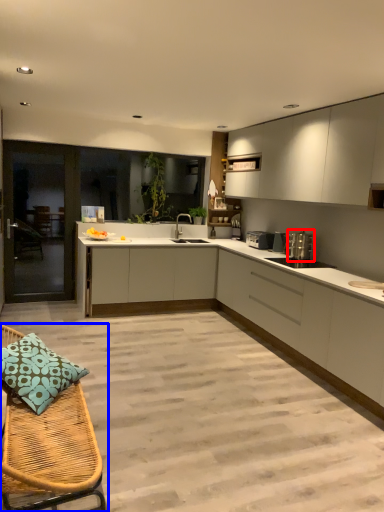
Question: Among these objects, which one is nearest to the camera, appliance (highlighted by a red box) or furniture (highlighted by a blue box)?

Choices:
 (A) appliance
 (B) furniture

Answer: (B)